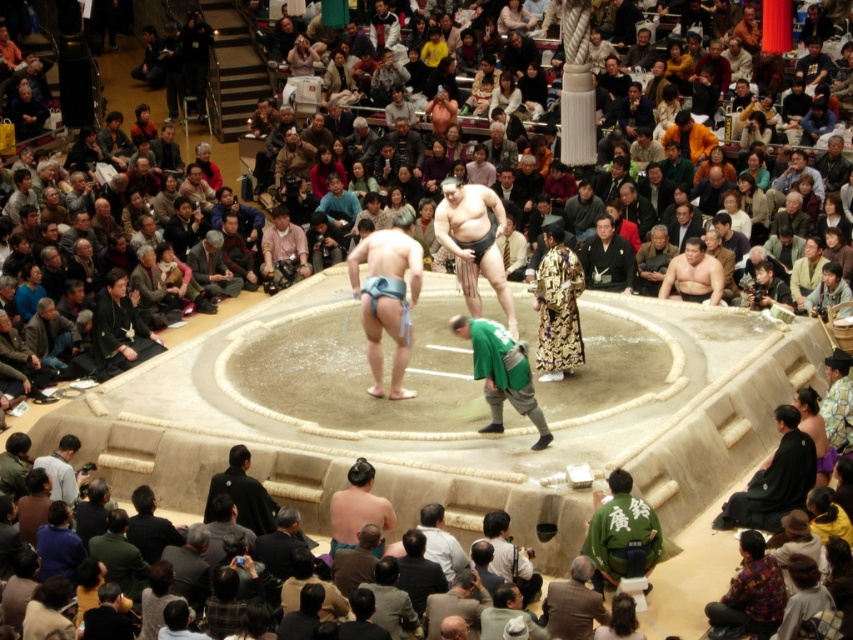
Question: Which object is positioned farthest from the green fabric at lower right?

Choices:
 (A) dark brown kimono at lower center
 (B) matte blue sumo at center

Answer: (B)

Question: Does green fabric at center have a larger size compared to matte pink shirt at center?

Choices:
 (A) yes
 (B) no

Answer: (A)

Question: Can you confirm if black silk kimono at lower left is positioned below silk kimono at center?

Choices:
 (A) yes
 (B) no

Answer: (A)

Question: In this image, where is black silk kimono at lower left located relative to dark brown kimono at lower center?

Choices:
 (A) left
 (B) right

Answer: (A)

Question: Which object appears farthest from the camera in this image?

Choices:
 (A) dark brown kimono at lower center
 (B) black silk kimono at lower right
 (C) green fabric at center
 (D) silk kimono at center

Answer: (D)

Question: Which point is farther to the camera?

Choices:
 (A) (456, 252)
 (B) (537, 404)
 (C) (329, 525)
 (D) (619, 288)

Answer: (D)